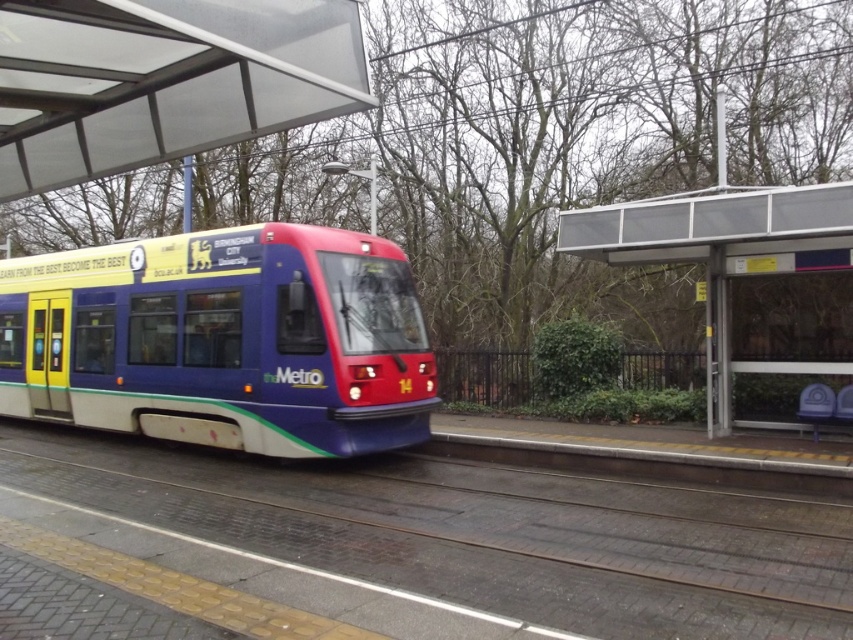
You are a maintenance worker checking the tram platform. You need to place a 2m wide equipment box between the metallic track at center and the matte blue train at center. Is there enough space between them?

The metallic track at center is wider than the matte blue train at center, but the description does not provide the exact distance between them. Therefore, it is uncertain if there is enough space for the 2m wide equipment box.